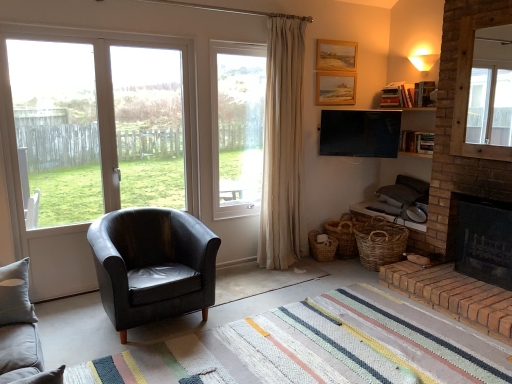
You are a GUI agent. You are given a task and a screenshot of the screen. Output one action in this format:
    pyautogui.click(x=<x>, y=<y>)
    Task: Click on the free spot to the left of woven brown baskets at lower right, which appears as the second basket when viewed from the left
    
    Given the screenshot: What is the action you would take?
    pyautogui.click(x=338, y=276)